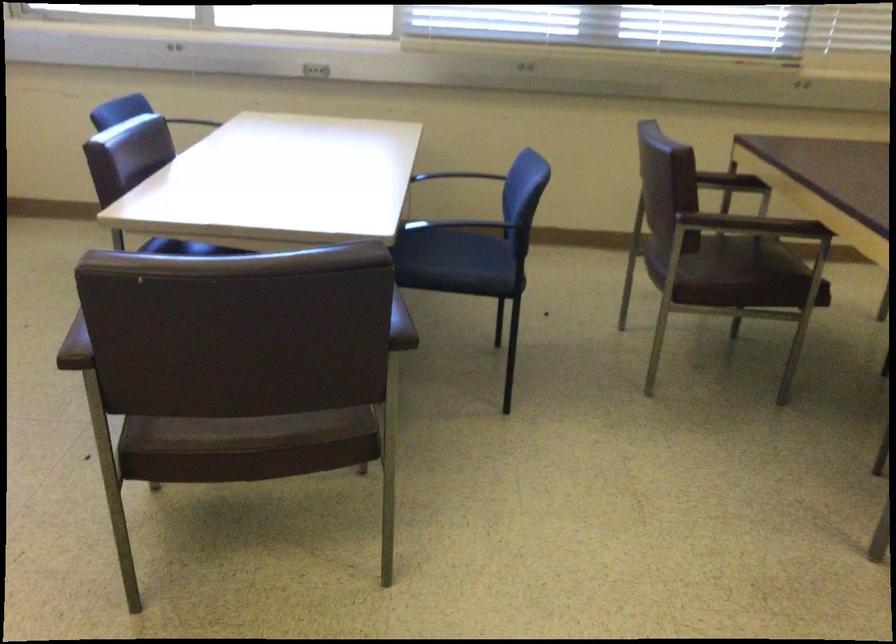
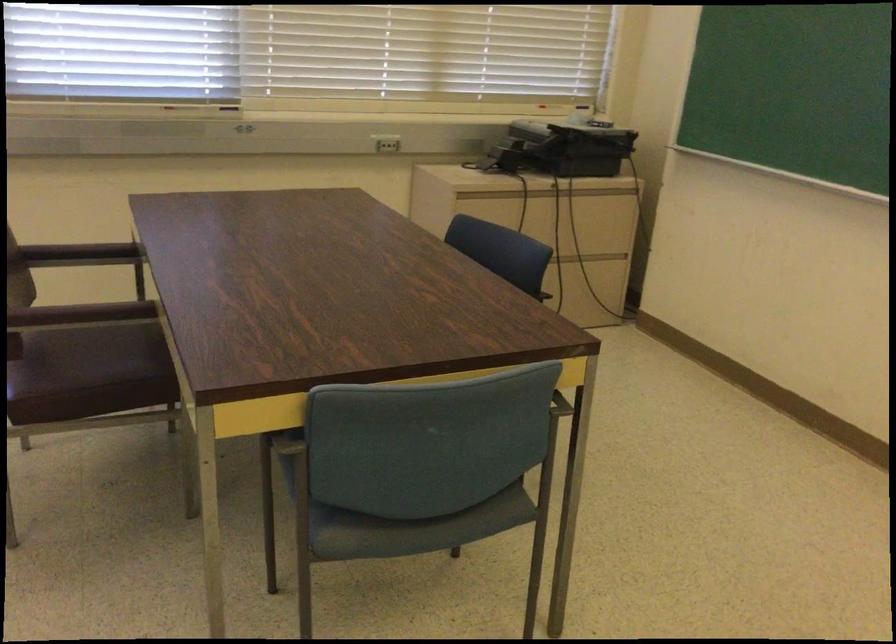
Question: In a continuous first-person perspective shot, in which direction is the camera moving?

Choices:
 (A) Left
 (B) Right
 (C) Forward
 (D) Backward

Answer: (B)